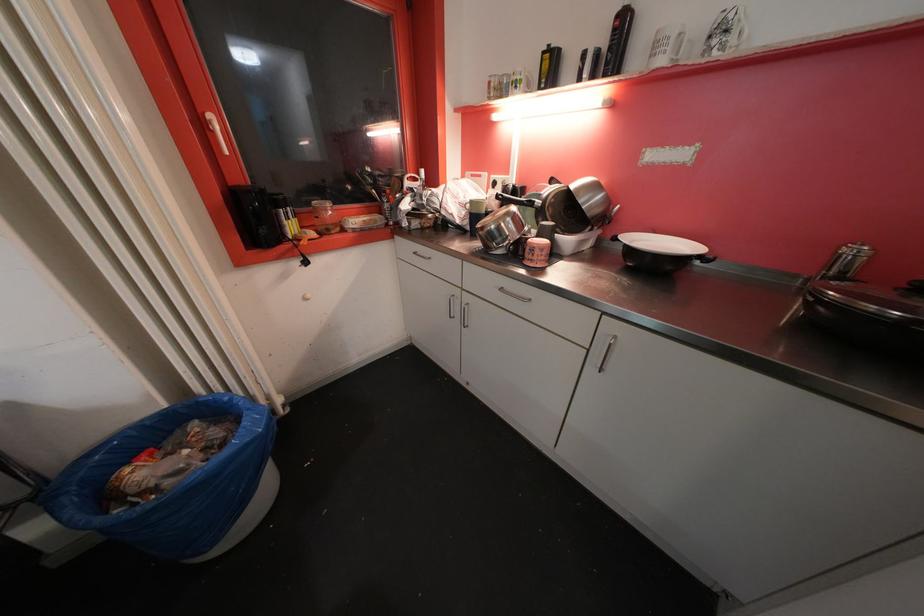
The image size is (924, 616). I want to click on white window handle, so tap(215, 131).